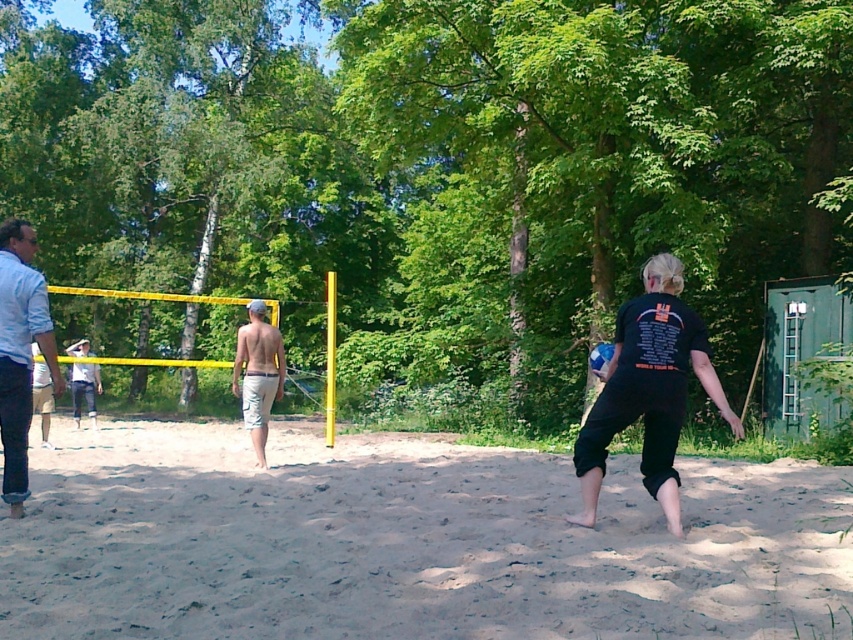
What do you see at coordinates (407, 541) in the screenshot?
I see `fine-grained sand at center` at bounding box center [407, 541].

Does fine-grained sand at center have a lesser height compared to tan shorts at center?

Correct, fine-grained sand at center is not as tall as tan shorts at center.

Between point (735, 636) and point (281, 362), which one is positioned in front?

Point (735, 636)

Where is `fine-grained sand at center`? fine-grained sand at center is located at coordinates (407, 541).

Between black matte t-shirt at center and blue matte volleyball at center, which one has less height?

With less height is blue matte volleyball at center.

Is point (682, 336) positioned behind point (608, 346)?

No, it is in front of (608, 346).

At what (x,y) coordinates should I click in order to perform the action: click on black matte t-shirt at center. Please return your answer as a coordinate pair (x, y). The image size is (853, 640). Looking at the image, I should click on (648, 388).

Is point (256, 330) farther from camera compared to point (86, 387)?

No, it is not.

Between tan shorts at center and light blue denim shorts at left, which one appears on the right side from the viewer's perspective?

tan shorts at center

What do you see at coordinates (258, 374) in the screenshot? I see `tan shorts at center` at bounding box center [258, 374].

At what (x,y) coordinates should I click in order to perform the action: click on tan shorts at center. Please return your answer as a coordinate pair (x, y). Image resolution: width=853 pixels, height=640 pixels. Looking at the image, I should click on (258, 374).